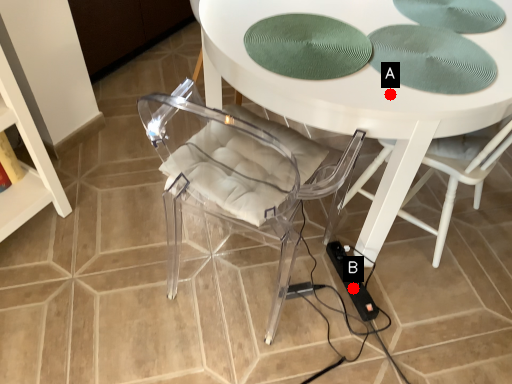
Question: Two points are circled on the image, labeled by A and B beside each circle. Which point is closer to the camera?

Choices:
 (A) A is closer
 (B) B is closer

Answer: (A)